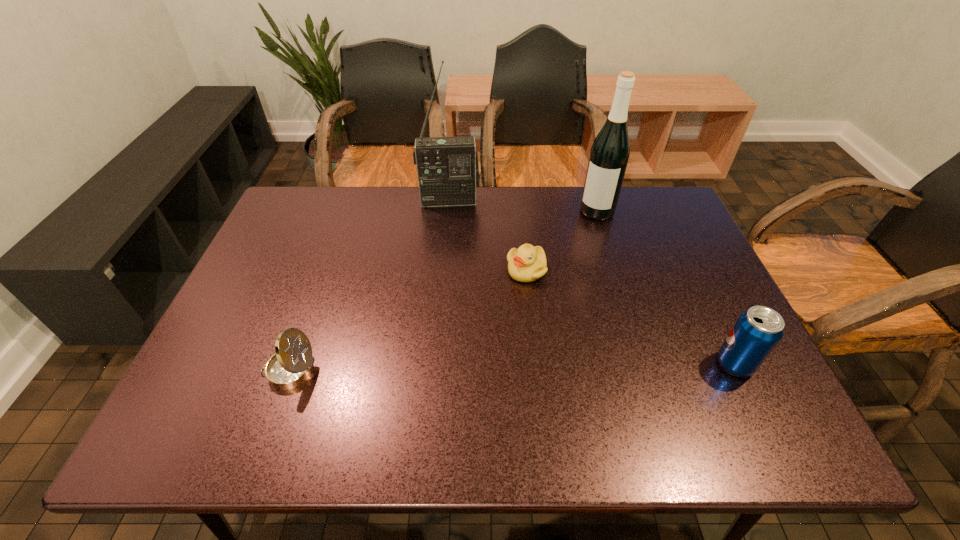
Identify the location of vacant space at the right edge of the desktop. The image size is (960, 540). (674, 236).

In the image, there is a desktop. Where is `vacant region at the near left corner`? The image size is (960, 540). vacant region at the near left corner is located at coordinates (237, 377).

Image resolution: width=960 pixels, height=540 pixels. I want to click on vacant point located between the second object from left to right and the fourth object from left to right, so click(523, 206).

Locate an element on the screen. The width and height of the screenshot is (960, 540). free space between the rightmost object and the compass is located at coordinates (512, 367).

Locate an element on the screen. This screenshot has width=960, height=540. free point between the wine bottle and the radio receiver is located at coordinates (523, 206).

This screenshot has height=540, width=960. In order to click on empty space that is in between the second object from right to left and the fourth tallest object in this screenshot , I will do `click(443, 291)`.

At what (x,y) coordinates should I click in order to perform the action: click on unoccupied position between the compass and the shortest object. Please return your answer as a coordinate pair (x, y). The width and height of the screenshot is (960, 540). Looking at the image, I should click on (408, 320).

Locate an element on the screen. The height and width of the screenshot is (540, 960). free space between the third object from right to left and the pop soda is located at coordinates (631, 317).

Locate an element on the screen. The height and width of the screenshot is (540, 960). empty space between the radio receiver and the third farthest object is located at coordinates (488, 235).

Identify the location of free point between the shortest object and the third tallest object. Image resolution: width=960 pixels, height=540 pixels. (631, 317).